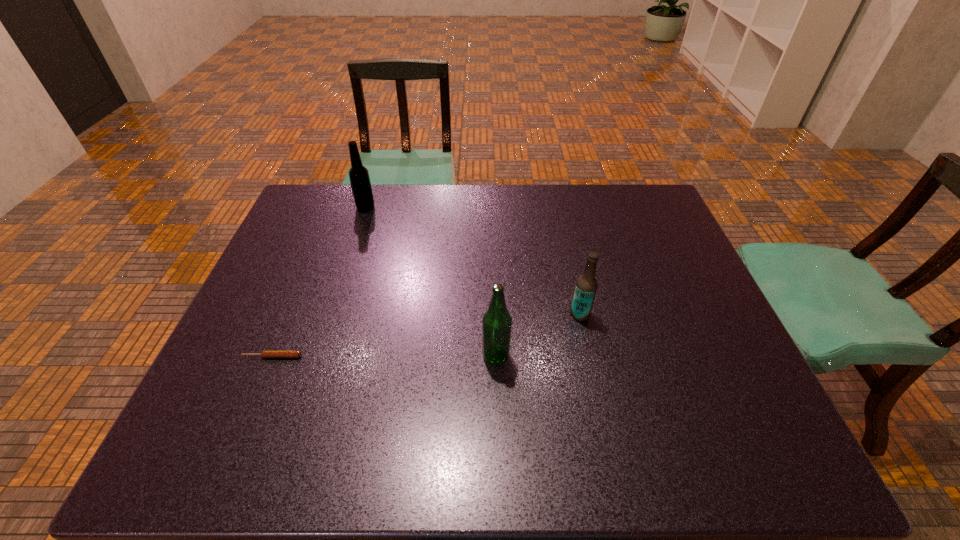
You are a GUI agent. You are given a task and a screenshot of the screen. Output one action in this format:
    pyautogui.click(x=<x>, y=<y>)
    Task: Click on the farthest object
    This screenshot has width=960, height=540.
    Given the screenshot: What is the action you would take?
    pyautogui.click(x=360, y=182)

The height and width of the screenshot is (540, 960). Find the location of `the third object from right to left`. the third object from right to left is located at coordinates (360, 182).

Where is `the second object from right to left`? This screenshot has height=540, width=960. the second object from right to left is located at coordinates (496, 323).

Find the location of a particular element. This screenshot has height=540, width=960. the nearest beer bottle is located at coordinates (496, 323).

Where is `the rightmost beer bottle`? The height and width of the screenshot is (540, 960). the rightmost beer bottle is located at coordinates (586, 286).

Identify the location of the second farthest object. (586, 286).

The width and height of the screenshot is (960, 540). I want to click on sausage, so click(266, 353).

Locate an element on the screen. This screenshot has width=960, height=540. the leftmost object is located at coordinates coord(266,353).

At what (x,y) coordinates should I click in order to perform the action: click on free space located 0.220m on the right of the leftmost beer bottle. Please return your answer as a coordinate pair (x, y). This screenshot has width=960, height=540. Looking at the image, I should click on (442, 207).

You are a GUI agent. You are given a task and a screenshot of the screen. Output one action in this format:
    pyautogui.click(x=<x>, y=<y>)
    Task: Click on the vacant space positioned 0.360m on the label of the nearest beer bottle
    
    Given the screenshot: What is the action you would take?
    pyautogui.click(x=328, y=356)